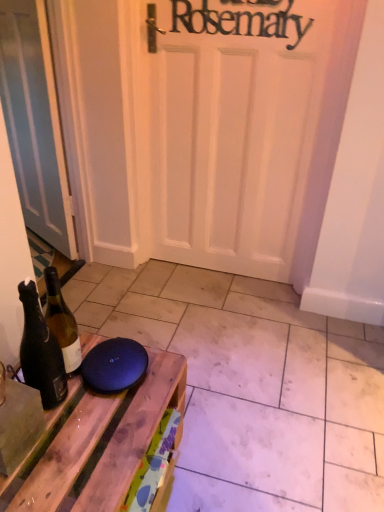
Question: Is matte wood tile at lower center aimed at matte white door at left?

Choices:
 (A) yes
 (B) no

Answer: (B)

Question: Is matte wood tile at lower center facing away from matte white door at left?

Choices:
 (A) yes
 (B) no

Answer: (B)

Question: Considering the relative sizes of matte wood tile at lower center and matte white door at left in the image provided, is matte wood tile at lower center bigger than matte white door at left?

Choices:
 (A) no
 (B) yes

Answer: (B)

Question: Is there a large distance between matte wood tile at lower center and matte white door at left?

Choices:
 (A) yes
 (B) no

Answer: (B)

Question: From a real-world perspective, is matte wood tile at lower center below matte white door at left?

Choices:
 (A) yes
 (B) no

Answer: (A)

Question: Which is correct: matte wood tile at lower center is inside matte white door at left, or outside of it?

Choices:
 (A) inside
 (B) outside

Answer: (B)

Question: Is matte wood tile at lower center wider or thinner than matte white door at left?

Choices:
 (A) wide
 (B) thin

Answer: (A)

Question: Considering the positions of matte wood tile at lower center and matte white door at left in the image, is matte wood tile at lower center bigger or smaller than matte white door at left?

Choices:
 (A) big
 (B) small

Answer: (A)

Question: Is point (355, 414) positioned closer to the camera than point (18, 44)?

Choices:
 (A) closer
 (B) farther

Answer: (A)

Question: Is matte white door at left taller or shorter than wooden table at lower left?

Choices:
 (A) tall
 (B) short

Answer: (A)

Question: From a real-world perspective, is matte white door at left physically located above or below wooden table at lower left?

Choices:
 (A) below
 (B) above

Answer: (B)

Question: Based on their positions, is matte white door at left located to the left or right of wooden table at lower left?

Choices:
 (A) left
 (B) right

Answer: (A)

Question: Is matte white door at left spatially inside wooden table at lower left, or outside of it?

Choices:
 (A) outside
 (B) inside

Answer: (A)

Question: From the image's perspective, relative to matte wood tile at lower center, is matte white door at left above or below?

Choices:
 (A) above
 (B) below

Answer: (A)

Question: From a real-world perspective, is matte white door at left above or below matte wood tile at lower center?

Choices:
 (A) above
 (B) below

Answer: (A)